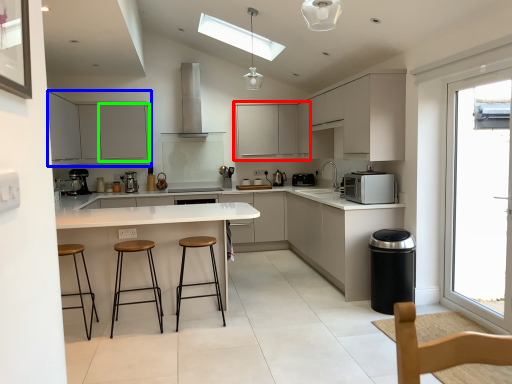
Question: Which object is the closest to the cabinetry (highlighted by a red box)? Choose among these: cabinetry (highlighted by a blue box) or cabinetry (highlighted by a green box).

Choices:
 (A) cabinetry
 (B) cabinetry

Answer: (B)